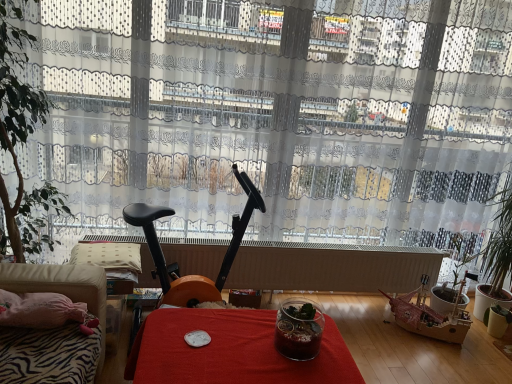
Locate an element on the screen. This screenshot has width=512, height=384. free location in front of transparent glass jar at center is located at coordinates (292, 372).